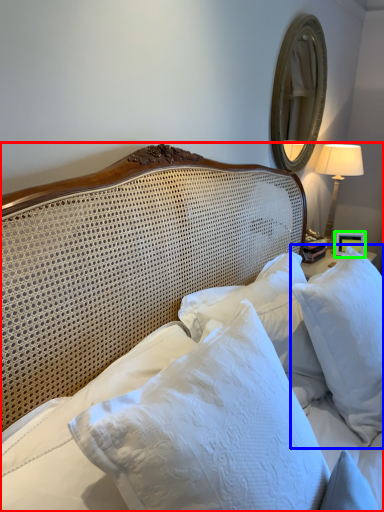
Question: Which object is positioned closest to bed (highlighted by a red box)? Select from pillow (highlighted by a blue box) and picture frame (highlighted by a green box).

Choices:
 (A) pillow
 (B) picture frame

Answer: (A)